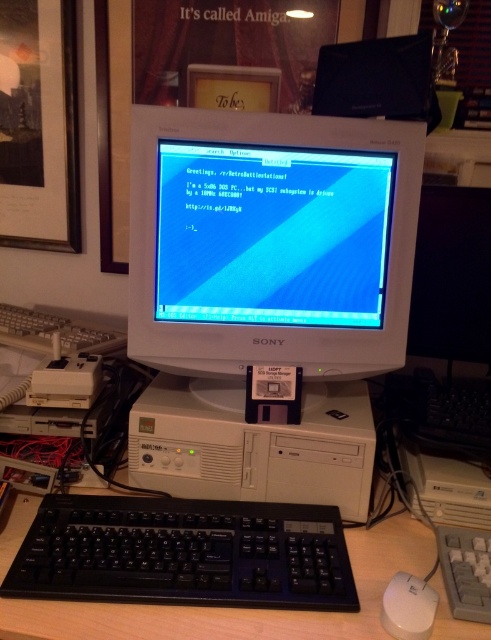
You are setting up a desk for a retro computing enthusiast. You have a black plastic keyboard at lower center and a white plastic mouse at lower right. The desk has a space that can only accommodate items up to 40 cm in width. If the mouse is 10 cm wide, will the keyboard fit in the remaining space?

The black plastic keyboard at lower center is larger than the white plastic mouse at lower right. Since the mouse is 10 cm wide, the keyboard must be wider than 10 cm. The total space required would exceed 40 cm if placed together, but the question specifies the remaining space after placing the mouse. However, the exact width isnot provided, so we cannot definitively determine if it fits. However, since the keyboard is larger than the mouse, and the mouse is 10 cm, the keyboard is at least 11 cm. If the 40

You are a technician who needs to reach the point at coordinates point (431, 68) to fix a connection. Your arm can extend 36 inches. Can you reach it?

The distance between point (431, 68) and the camera is 34.74 inches, so yes, your arm can reach it since it extends 36 inches.

You are setting up a retro gaming station and need to place both the black plastic keyboard at lower center and the white plastic mouse at lower right on a desk. If the desk has a space that can only accommodate items up to the size of the keyboard, will both items fit?

The black plastic keyboard at lower center is bigger than the white plastic mouse at lower right. Since the desk space can only fit items up to the keyboard size, the keyboard will occupy the entire space, leaving no room for the mouse.